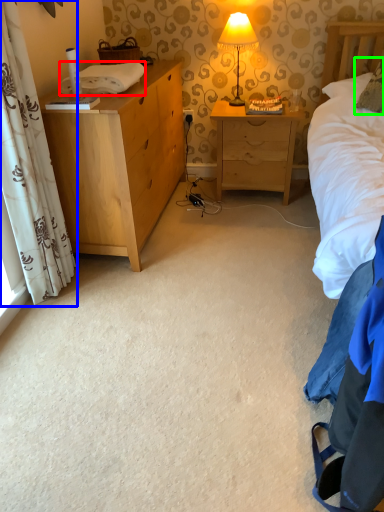
Question: Which object is the farthest from cloth (highlighted by a red box)? Choose among these: curtain (highlighted by a blue box) or pillow (highlighted by a green box).

Choices:
 (A) curtain
 (B) pillow

Answer: (B)